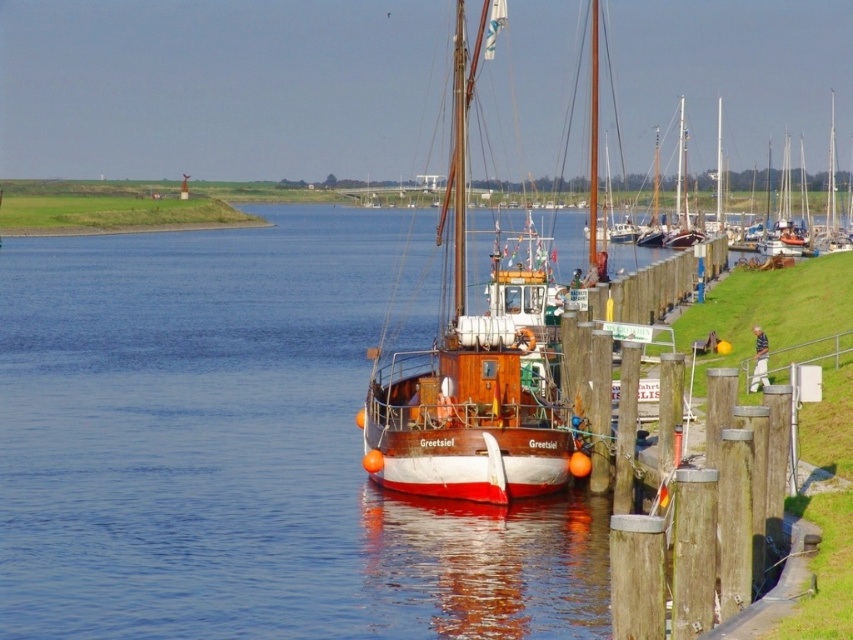
Question: Which point is closer to the camera?

Choices:
 (A) (430, 442)
 (B) (370, 588)

Answer: (B)

Question: Which object appears farthest from the camera in this image?

Choices:
 (A) wooden sailboat at center
 (B) smooth blue water at center

Answer: (A)

Question: Is smooth blue water at center positioned before wooden sailboat at center?

Choices:
 (A) yes
 (B) no

Answer: (A)

Question: Is smooth blue water at center above wooden sailboat at center?

Choices:
 (A) yes
 (B) no

Answer: (B)

Question: Among these points, which one is farthest from the camera?

Choices:
 (A) (82, 323)
 (B) (366, 394)

Answer: (A)

Question: Is smooth blue water at center positioned before wooden sailboat at center?

Choices:
 (A) no
 (B) yes

Answer: (B)